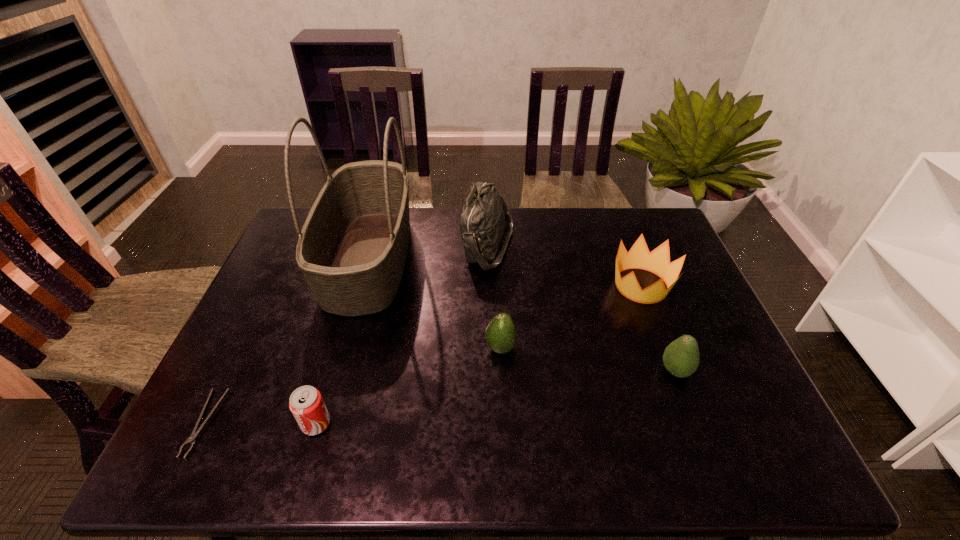
This screenshot has height=540, width=960. Find the location of `empty space between the right avocado and the sixth shortest object`. empty space between the right avocado and the sixth shortest object is located at coordinates (582, 308).

Identify the location of empty space that is in between the right avocado and the leftmost object. (441, 397).

Image resolution: width=960 pixels, height=540 pixels. Identify the location of the third closest object relative to the left avocado. (657, 261).

Identify which object is the fourth nearest to the soda can. Please provide its 2D coordinates. Your answer should be formatted as a tuple, i.e. [(x, y)], where the tuple contains the x and y coordinates of a point satisfying the conditions above.

[(485, 216)]

Where is `vacant space that satisfies the following two spatial constraints: 1. at the front padded panel of the second tallest object; 2. on the front side of the tallest object`? vacant space that satisfies the following two spatial constraints: 1. at the front padded panel of the second tallest object; 2. on the front side of the tallest object is located at coordinates (489, 258).

Identify the location of blank area in the image that satisfies the following two spatial constraints: 1. at the front padded panel of the shoulder bag; 2. on the right side of the left avocado. Image resolution: width=960 pixels, height=540 pixels. (491, 348).

Where is `vacant point that satisfies the following two spatial constraints: 1. on the front side of the crown; 2. on the left side of the right avocado`? Image resolution: width=960 pixels, height=540 pixels. vacant point that satisfies the following two spatial constraints: 1. on the front side of the crown; 2. on the left side of the right avocado is located at coordinates (674, 371).

Find the location of a particular element. This screenshot has width=960, height=540. vacant area that satisfies the following two spatial constraints: 1. on the back side of the soda can; 2. on the right side of the tallest object is located at coordinates (365, 258).

This screenshot has height=540, width=960. What are the coordinates of `free space that satisfies the following two spatial constraints: 1. on the front side of the right avocado; 2. on the right side of the basket` in the screenshot? It's located at (337, 371).

Locate an element on the screen. vacant space that satisfies the following two spatial constraints: 1. on the back side of the tongs; 2. on the right side of the basket is located at coordinates (287, 258).